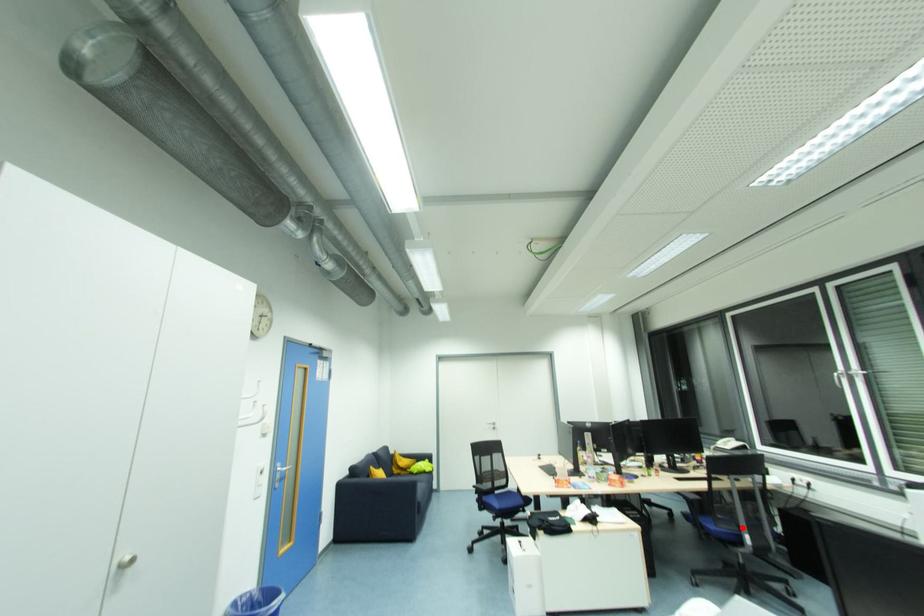
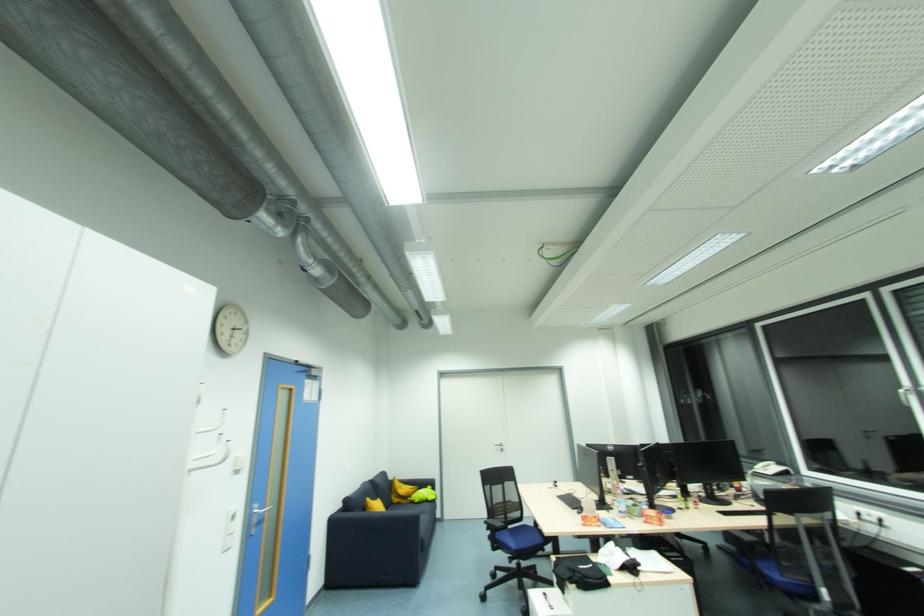
Question: I am providing you with two images of the same scene from different viewpoints. Image1 has a red point marked. In image2, the corresponding 3D location appears at what relative position? Reply with the corresponding letter.

Choices:
 (A) Closer
 (B) Farther

Answer: (A)